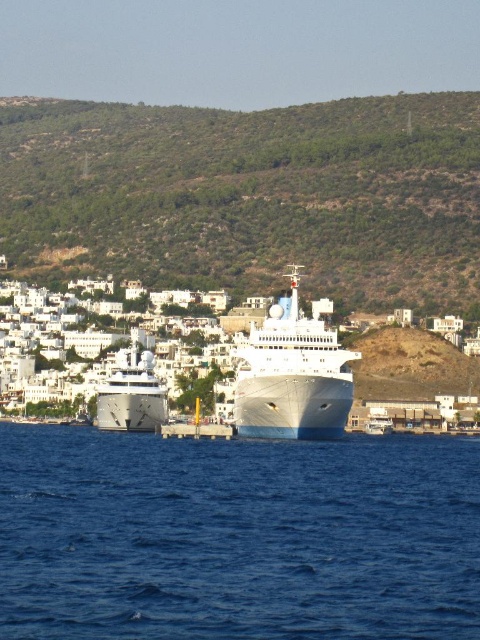
Question: Does blue liquid water at center have a greater width compared to white glossy boat at center?

Choices:
 (A) no
 (B) yes

Answer: (B)

Question: Considering the real-world distances, which object is closest to the green grassy hillside at upper center?

Choices:
 (A) blue liquid water at center
 (B) white glossy cruise ship at center
 (C) white matte building at center

Answer: (C)

Question: Among these objects, which one is nearest to the camera?

Choices:
 (A) green grassy hillside at upper center
 (B) white glossy cruise ship at center

Answer: (B)

Question: Which object is positioned closest to the green grassy hillside at upper center?

Choices:
 (A) white glossy boat at center
 (B) polished silver yacht at center
 (C) white glossy cruise ship at center
 (D) white matte building at center

Answer: (D)

Question: Can you confirm if blue liquid water at center is thinner than white glossy boat at center?

Choices:
 (A) no
 (B) yes

Answer: (A)

Question: Where is blue liquid water at center located in relation to polished silver yacht at center in the image?

Choices:
 (A) below
 (B) above

Answer: (A)